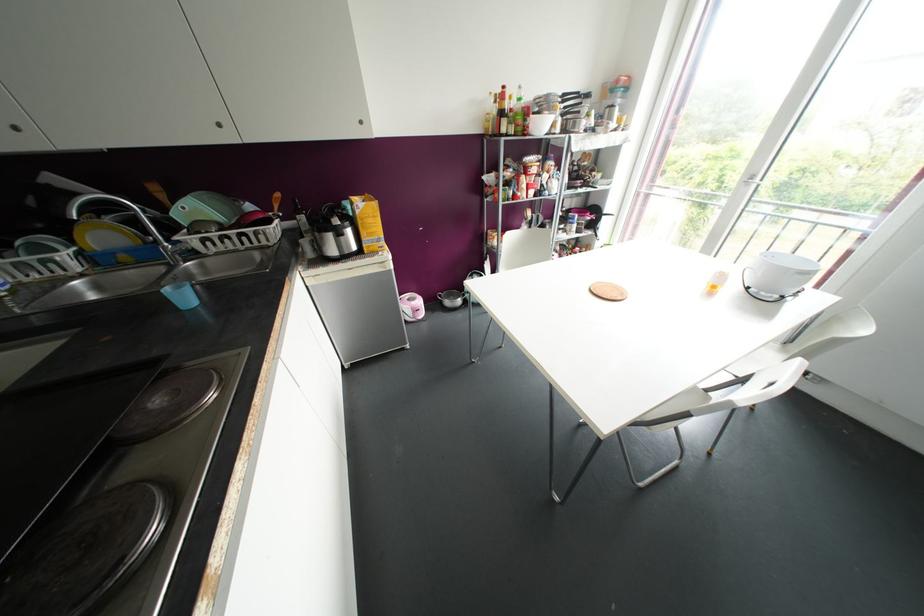
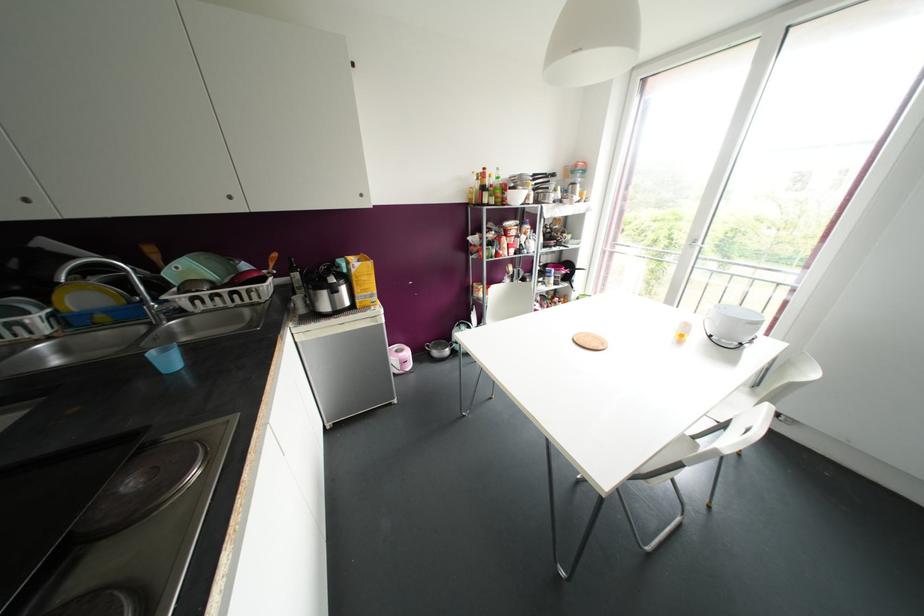
In the second image, find the point that corresponds to [713,286] in the first image.

(681, 334)